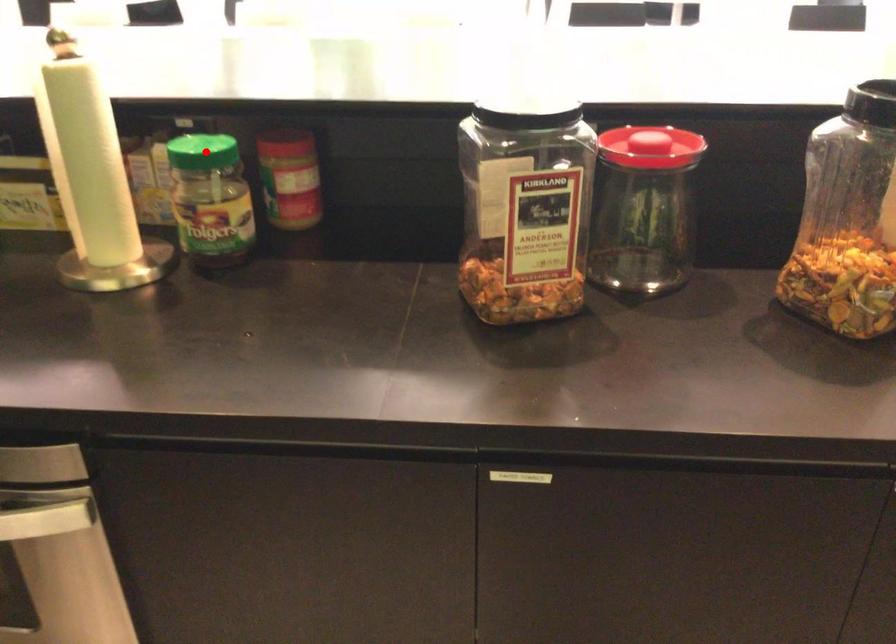
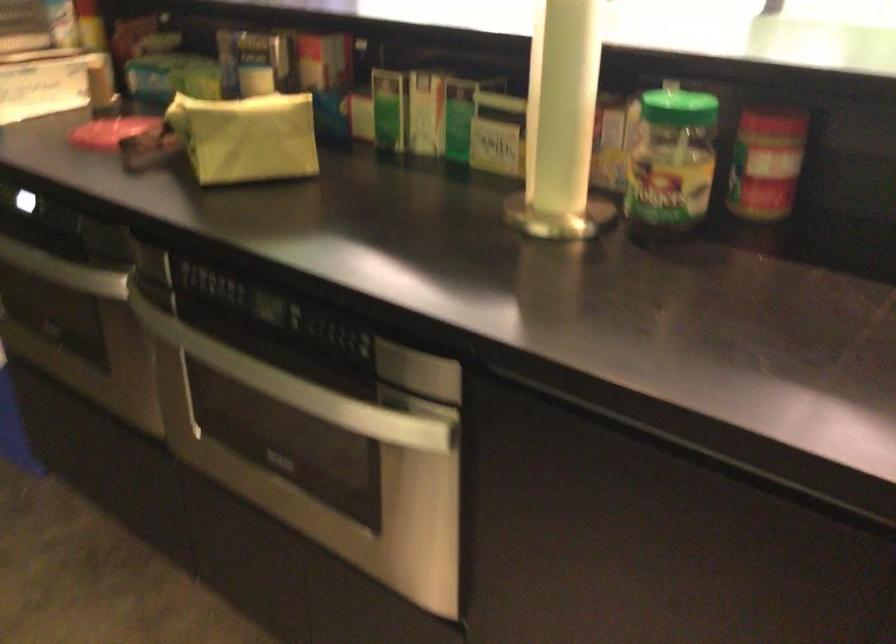
Question: I am providing you with two images of the same scene from different viewpoints. Given a red point in image1, look at the same physical point in image2. Is it:

Choices:
 (A) Closer to the viewpoint
 (B) Farther from the viewpoint

Answer: (A)